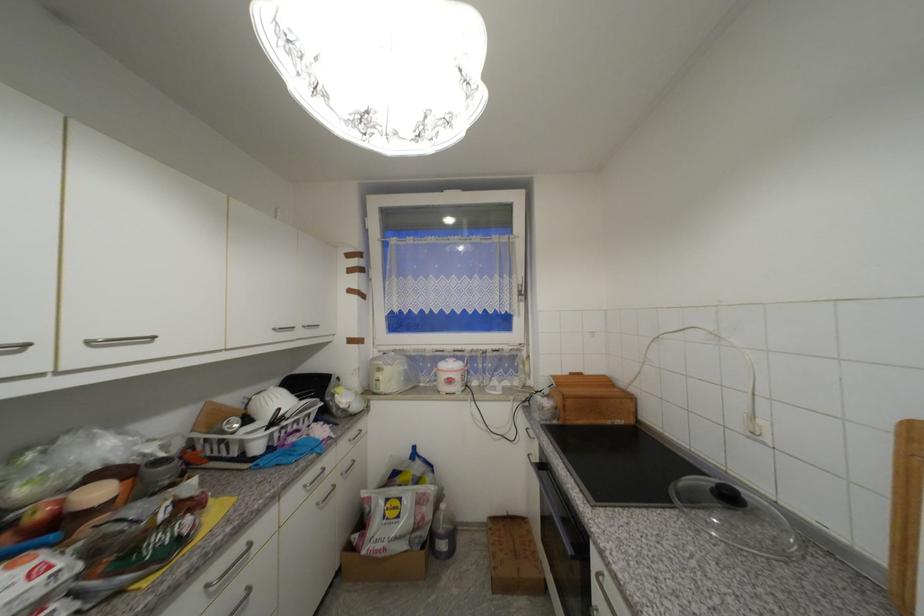
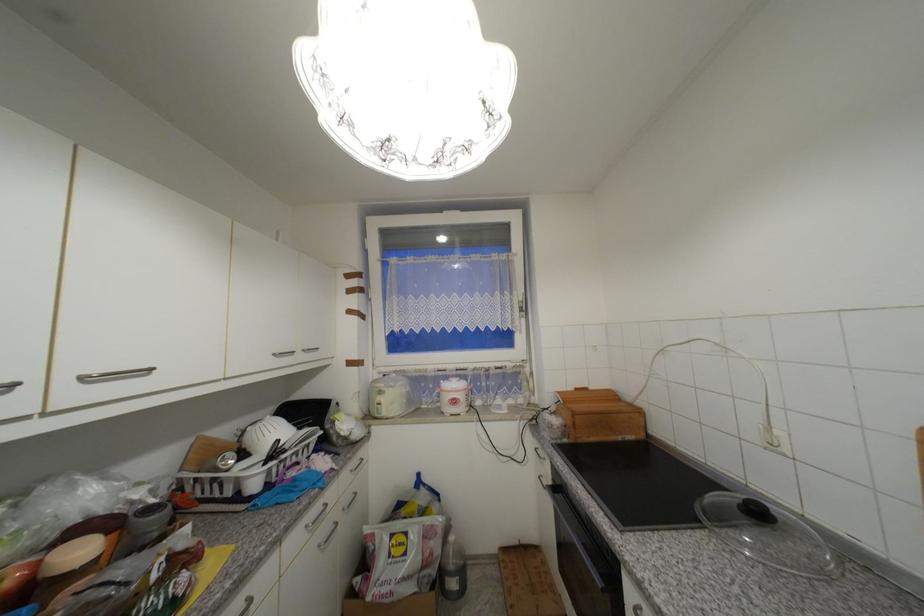
In the second image, find the point that corresponds to pixel 32 346 in the first image.

(19, 386)